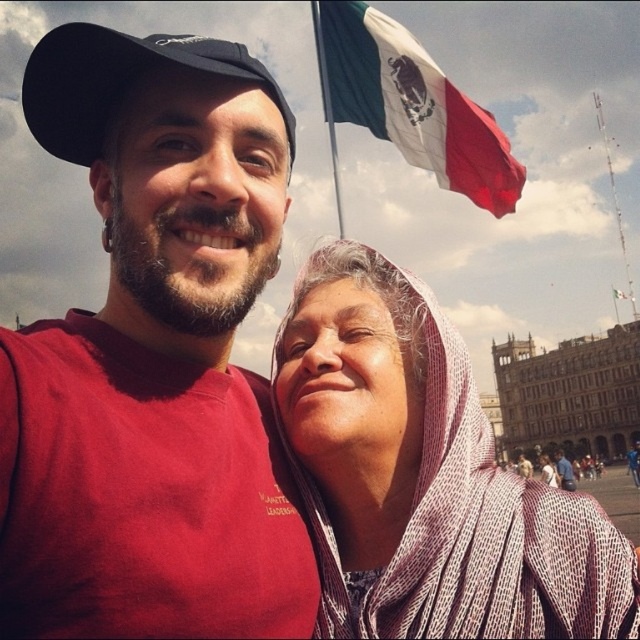
Can you confirm if matte red t-shirt at center is smaller than white textured scarf at center?

Actually, matte red t-shirt at center might be larger than white textured scarf at center.

In the scene shown: Does matte red t-shirt at center have a larger size compared to white textured scarf at center?

Indeed, matte red t-shirt at center has a larger size compared to white textured scarf at center.

Between point (44, 625) and point (621, 572), which one is positioned behind?

Point (621, 572)

Where is `matte red t-shirt at center`? matte red t-shirt at center is located at coordinates (154, 358).

Can you confirm if white textured scarf at center is positioned to the left of black fabric baseball cap at upper left?

No, white textured scarf at center is not to the left of black fabric baseball cap at upper left.

What are the coordinates of `white textured scarf at center` in the screenshot? It's located at (426, 476).

Identify the location of white textured scarf at center. This screenshot has width=640, height=640. (426, 476).

Is white textured scarf at center below green-white-red fabric flag at upper center?

Indeed, white textured scarf at center is positioned under green-white-red fabric flag at upper center.

Which is behind, point (621, 572) or point (358, 8)?

The point (358, 8) is more distant.

In the scene shown: Who is more distant from viewer, (x=401, y=435) or (x=440, y=186)?

Point (x=440, y=186)

Find the location of a particular element. white textured scarf at center is located at coordinates (426, 476).